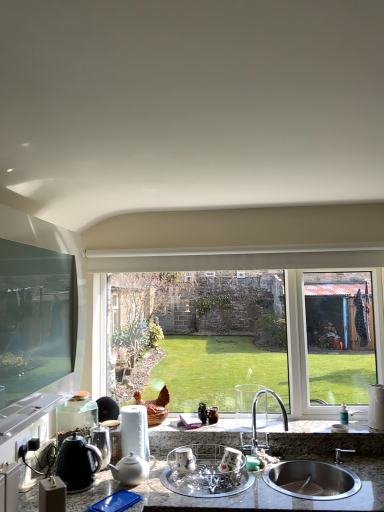
Question: Considering the positions of white ceramic vase at right, placed as the third appliance when sorted from left to right, and granite gray countertop at lower center in the image, is white ceramic vase at right, placed as the third appliance when sorted from left to right, bigger or smaller than granite gray countertop at lower center?

Choices:
 (A) small
 (B) big

Answer: (A)

Question: Would you say white ceramic vase at right, the first appliance from the right, is inside or outside granite gray countertop at lower center?

Choices:
 (A) outside
 (B) inside

Answer: (A)

Question: Which is nearer to the white glossy teapot at lower center, which is the first tea pot in right-to-left order?

Choices:
 (A) white ceramic vase at right, the 1th appliance from the back
 (B) shiny metallic kettle at lower left, positioned as the second appliance in front-to-back order
 (C) green glass window at center
 (D) clear plastic dish rack at center, the 2th appliance viewed from the right
 (E) stainless steel sink at lower right

Answer: (B)

Question: Estimate the real-world distances between objects in this image. Which object is farther from the satin nickel faucet at center?

Choices:
 (A) granite gray countertop at lower center
 (B) white ceramic vase at right, the 1th appliance from the back
 (C) stainless steel sink at lower right
 (D) shiny metallic kettle at lower left, which ranks as the 2th appliance in back-to-front order
 (E) white glossy teapot at lower center, the 2th tea pot when ordered from left to right

Answer: (D)